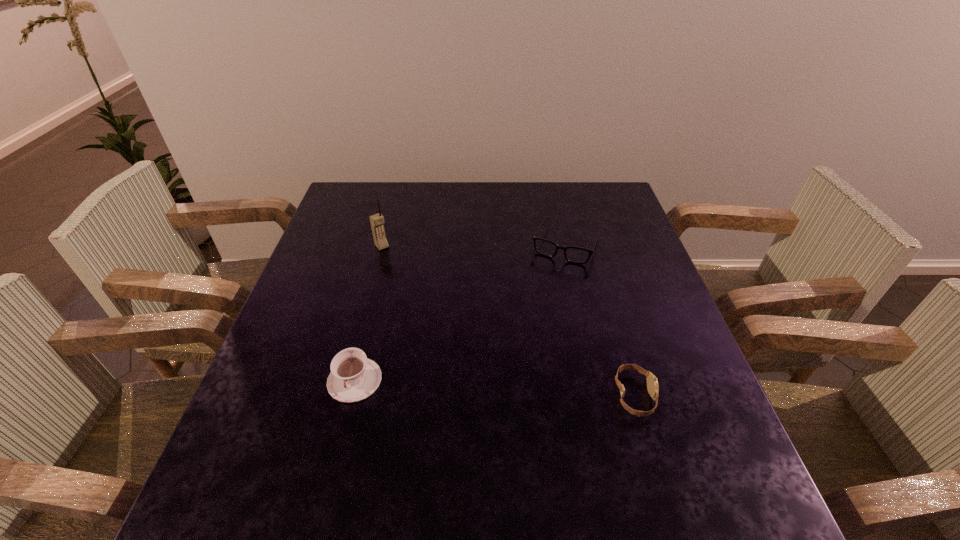
Identify the location of blank area at the right edge. (694, 361).

Image resolution: width=960 pixels, height=540 pixels. Find the location of `free location at the near left corner`. free location at the near left corner is located at coordinates (300, 448).

In the image, there is a desktop. Where is `vacant space at the far right corner`? This screenshot has width=960, height=540. vacant space at the far right corner is located at coordinates (617, 205).

The height and width of the screenshot is (540, 960). Identify the location of vacant space at the near right corner. (653, 424).

Locate an element on the screen. This screenshot has height=540, width=960. vacant area between the watch and the spectacles is located at coordinates (600, 320).

The height and width of the screenshot is (540, 960). I want to click on vacant area between the cellular telephone and the shortest object, so click(x=508, y=321).

Where is `free spot between the spectacles and the tallest object`? The width and height of the screenshot is (960, 540). free spot between the spectacles and the tallest object is located at coordinates point(474,245).

I want to click on free space that is in between the watch and the teacup, so click(494, 388).

At what (x,y) coordinates should I click in order to perform the action: click on empty location between the teacup and the cellular telephone. Please return your answer as a coordinate pair (x, y). Looking at the image, I should click on (369, 313).

Image resolution: width=960 pixels, height=540 pixels. Find the location of `free space between the teacup and the watch`. free space between the teacup and the watch is located at coordinates (494, 388).